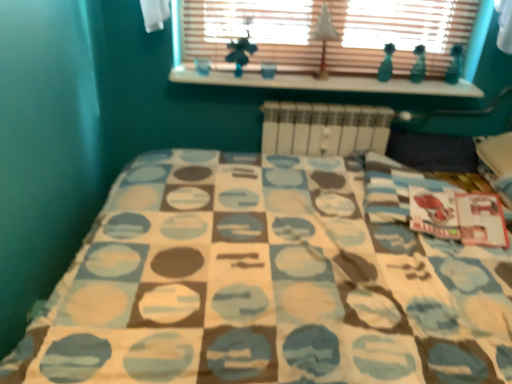
Question: In terms of width, does white paper tree at upper center look wider or thinner when compared to wooden blinds at upper center?

Choices:
 (A) thin
 (B) wide

Answer: (B)

Question: In terms of size, does white paper tree at upper center appear bigger or smaller than wooden blinds at upper center?

Choices:
 (A) big
 (B) small

Answer: (B)

Question: Which object is positioned farthest from the white painted wood at upper center?

Choices:
 (A) white paper tree at upper center
 (B) white matte radiator at center
 (C) wooden blinds at upper center

Answer: (A)

Question: Which object is positioned closest to the white paper tree at upper center?

Choices:
 (A) wooden blinds at upper center
 (B) white matte radiator at center
 (C) white painted wood at upper center

Answer: (A)